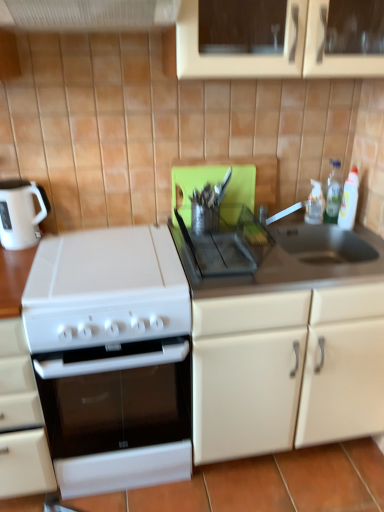
You are a GUI agent. You are given a task and a screenshot of the screen. Output one action in this format:
    pyautogui.click(x=<x>, y=<y>)
    Task: Click on the vacant region to the left of white plastic bottle at upper right, the first bottle in the right-to-left sequence
    The width and height of the screenshot is (384, 512).
    Given the screenshot: What is the action you would take?
    pyautogui.click(x=319, y=224)